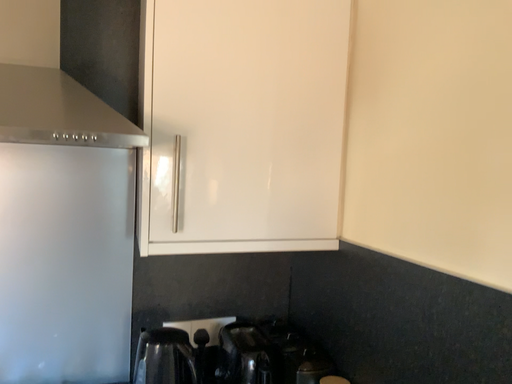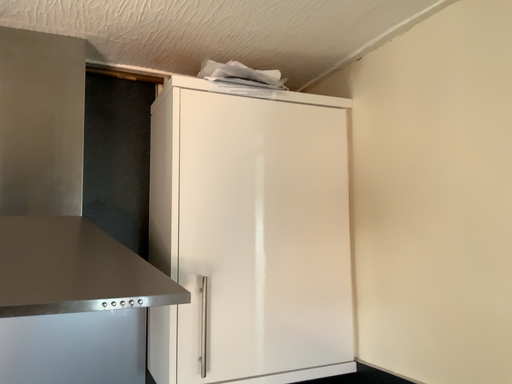
Question: How did the camera likely rotate when shooting the video?

Choices:
 (A) rotated upward
 (B) rotated downward

Answer: (A)